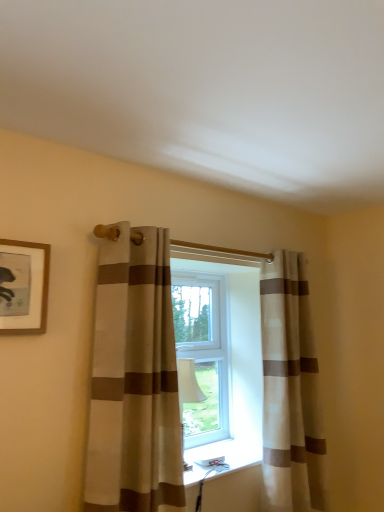
Question: From a real-world perspective, is beige striped curtain at center, acting as the first curtain starting from the left, over beige striped curtain at center, arranged as the first curtain when viewed from the back?

Choices:
 (A) no
 (B) yes

Answer: (B)

Question: Considering the relative positions of beige striped curtain at center, acting as the first curtain starting from the left, and beige striped curtain at center, arranged as the first curtain when viewed from the back, in the image provided, is beige striped curtain at center, acting as the first curtain starting from the left, to the right of beige striped curtain at center, arranged as the first curtain when viewed from the back, from the viewer's perspective?

Choices:
 (A) no
 (B) yes

Answer: (A)

Question: Is beige striped curtain at center, which is the 2th curtain from right to left, facing away from beige striped curtain at center, the 2th curtain positioned from the front?

Choices:
 (A) yes
 (B) no

Answer: (B)

Question: Can you confirm if beige striped curtain at center, placed as the 1th curtain when sorted from front to back, is positioned to the left of beige striped curtain at center, the 2th curtain positioned from the front?

Choices:
 (A) yes
 (B) no

Answer: (A)

Question: Does beige striped curtain at center, acting as the first curtain starting from the left, lie behind beige striped curtain at center, the 2th curtain positioned from the front?

Choices:
 (A) yes
 (B) no

Answer: (B)

Question: From the image's perspective, is beige striped curtain at center, placed as the 1th curtain when sorted from front to back, over beige striped curtain at center, the 2th curtain when ordered from left to right?

Choices:
 (A) no
 (B) yes

Answer: (B)

Question: Is wooden-framed picture at upper left looking in the opposite direction of beige striped curtain at center, the 2th curtain when ordered from back to front?

Choices:
 (A) yes
 (B) no

Answer: (B)

Question: Does wooden-framed picture at upper left have a lesser width compared to beige striped curtain at center, acting as the first curtain starting from the left?

Choices:
 (A) no
 (B) yes

Answer: (B)

Question: Is wooden-framed picture at upper left taller than beige striped curtain at center, which is the 2th curtain from right to left?

Choices:
 (A) yes
 (B) no

Answer: (B)

Question: Can we say wooden-framed picture at upper left lies outside beige striped curtain at center, placed as the 1th curtain when sorted from front to back?

Choices:
 (A) no
 (B) yes

Answer: (B)

Question: From a real-world perspective, does wooden-framed picture at upper left stand above beige striped curtain at center, the 2th curtain when ordered from back to front?

Choices:
 (A) yes
 (B) no

Answer: (A)

Question: Is beige striped curtain at center, the 2th curtain when ordered from back to front, located within wooden-framed picture at upper left?

Choices:
 (A) yes
 (B) no

Answer: (B)

Question: Is beige striped curtain at center, which is the 1th curtain in right-to-left order, positioned beyond the bounds of beige striped curtain at center, the 2th curtain when ordered from back to front?

Choices:
 (A) no
 (B) yes

Answer: (B)